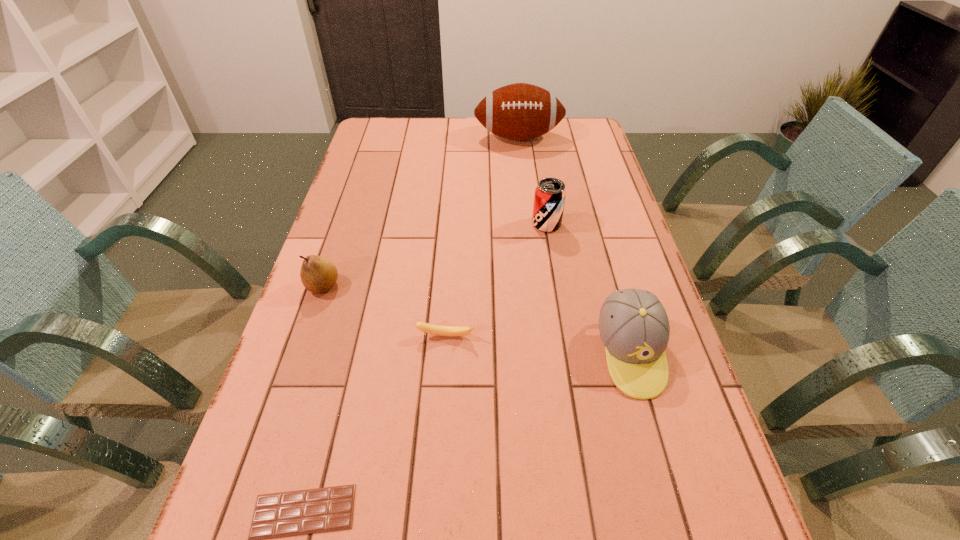
Identify the location of the tallest object. The width and height of the screenshot is (960, 540). (520, 111).

The height and width of the screenshot is (540, 960). Identify the location of football. (520, 111).

Locate an element on the screen. soda can is located at coordinates (549, 200).

This screenshot has width=960, height=540. Find the location of `baseball cap`. baseball cap is located at coordinates (634, 327).

Find the location of a particular element. The width and height of the screenshot is (960, 540). the fourth nearest object is located at coordinates (318, 274).

Where is `banana`? The image size is (960, 540). banana is located at coordinates (428, 328).

Locate an element on the screen. This screenshot has height=540, width=960. vacant space located on the laces of the farthest object is located at coordinates (528, 221).

Locate an element on the screen. This screenshot has height=540, width=960. free space located on the left of the second farthest object is located at coordinates (444, 224).

The image size is (960, 540). Find the location of `vacant point located on the front-facing side of the baseball cap`. vacant point located on the front-facing side of the baseball cap is located at coordinates (677, 517).

Where is `vacant area located 0.210m on the right of the pear`? The width and height of the screenshot is (960, 540). vacant area located 0.210m on the right of the pear is located at coordinates (421, 286).